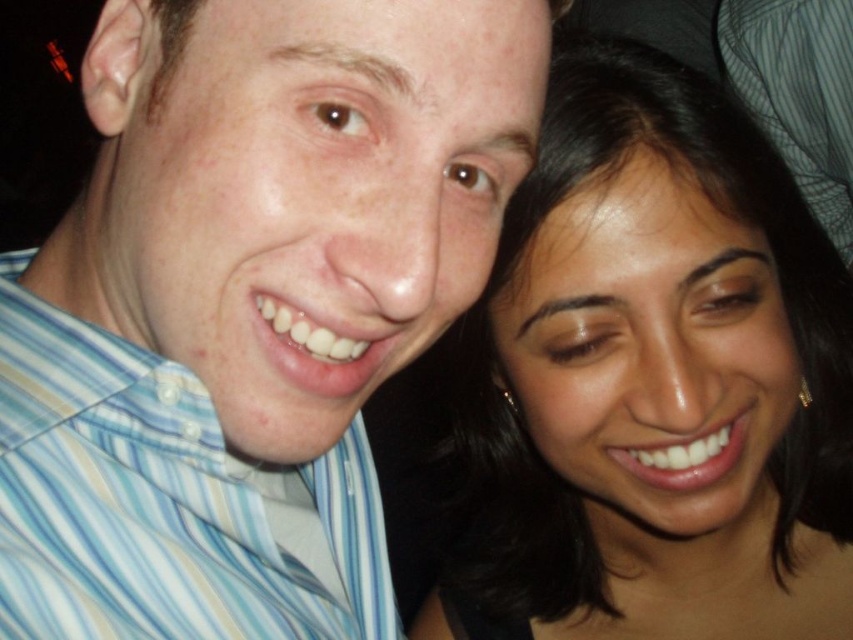
You are a photographer trying to adjust the lighting for a portrait. You notice the dark brown hair at upper right and the blue striped shirt at upper left in the frame. Which object should you focus on to ensure proper exposure since it occupies a larger vertical space?

The dark brown hair at upper right is taller than the blue striped shirt at upper left, so you should focus on the dark brown hair at upper right for proper exposure due to its greater vertical height.

You are a photographer who wants to adjust the lighting to highlight the dark brown hair at upper right. Based on the scene description, where should you focus the light? Please provide coordinates as a pair of numbers between 0 and 1, like this example format 0.5,0.5

The dark brown hair at upper right is located at coordinates (654, 380). Focus the light there to highlight it.

Consider the image. Based on the scene description, which object is larger in size between the dark brown hair at upper right and the blue striped shirt at upper left?

The dark brown hair at upper right is bigger than the blue striped shirt at upper left according to the description.